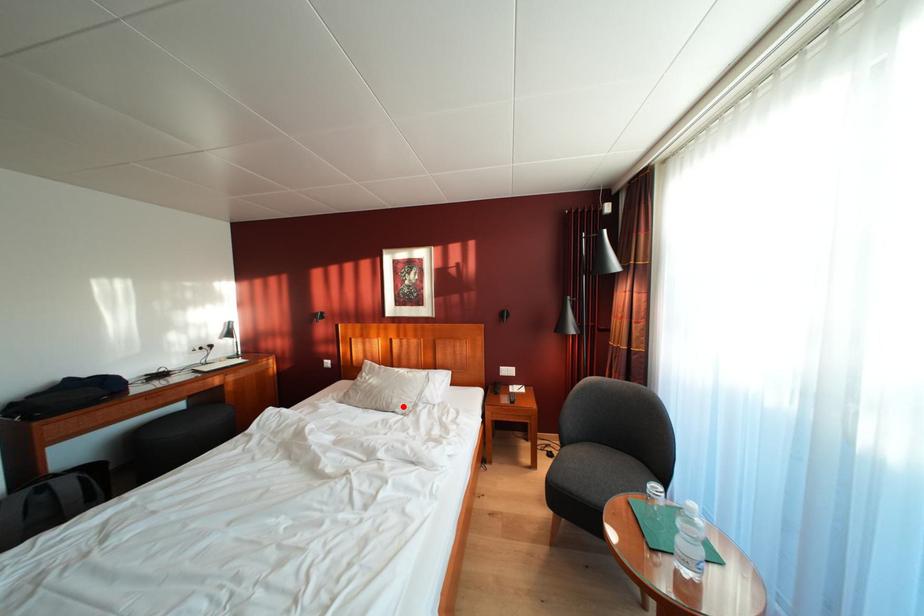
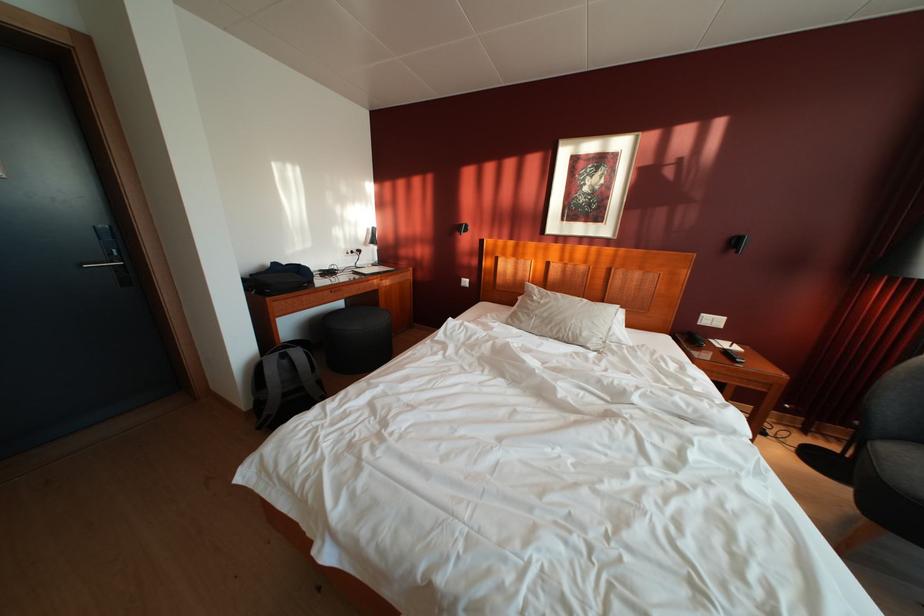
The point at the highlighted location is marked in the first image. Where is the corresponding point in the second image?

(593, 339)